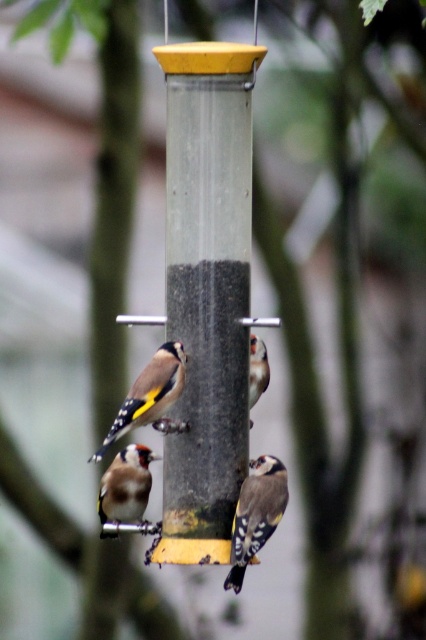
Question: Does golden-yellow feathers at center appear on the left side of brown speckled feathers at lower left?

Choices:
 (A) yes
 (B) no

Answer: (B)

Question: Based on their relative distances, which object is farther from the yellow and black speckled bird at center?

Choices:
 (A) golden-yellow feathers at center
 (B) brown speckled feathers at lower left
 (C) brown speckled feathers at center

Answer: (A)

Question: Which point appears farthest from the camera in this image?

Choices:
 (A) (144, 531)
 (B) (160, 413)
 (C) (250, 428)

Answer: (C)

Question: Does golden-yellow feathers at center lie in front of brown speckled feathers at lower left?

Choices:
 (A) yes
 (B) no

Answer: (A)

Question: Does golden-yellow feathers at center appear on the left side of brown speckled feathers at lower left?

Choices:
 (A) yes
 (B) no

Answer: (B)

Question: Which point appears farthest from the camera in this image?

Choices:
 (A) [250, 355]
 (B) [114, 433]

Answer: (A)